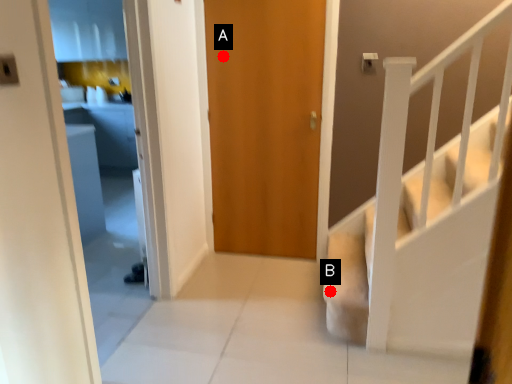
Question: Two points are circled on the image, labeled by A and B beside each circle. Which point is closer to the camera?

Choices:
 (A) A is closer
 (B) B is closer

Answer: (B)